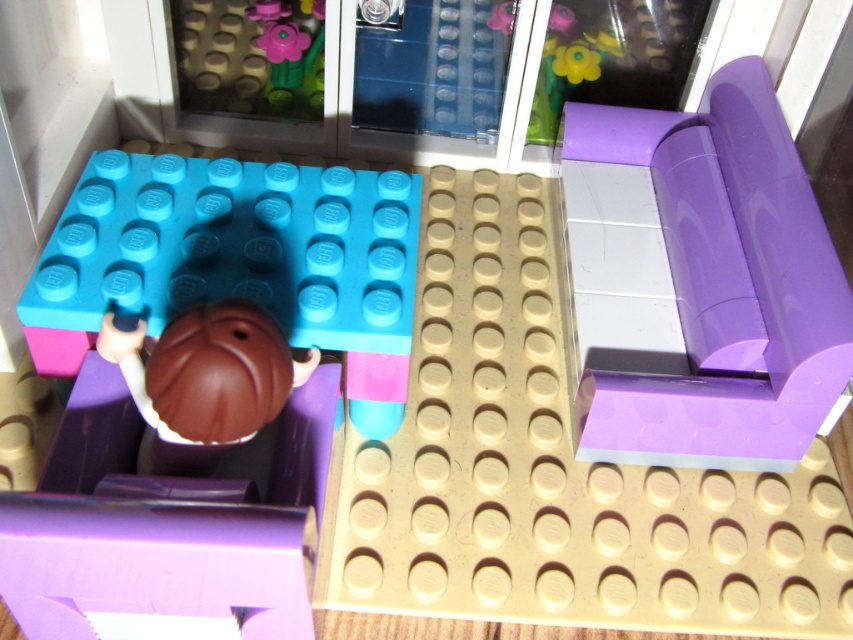
Question: Does purple glossy couch at upper right have a greater width compared to matte blue plate at center?

Choices:
 (A) no
 (B) yes

Answer: (A)

Question: Does purple glossy couch at upper right appear on the left side of matte blue plate at center?

Choices:
 (A) no
 (B) yes

Answer: (A)

Question: Which point is closer to the camera?

Choices:
 (A) (686, 157)
 (B) (62, 225)

Answer: (B)

Question: Which point is farther to the camera?

Choices:
 (A) matte blue plate at center
 (B) purple glossy couch at upper right

Answer: (B)

Question: Does purple glossy couch at upper right have a larger size compared to matte blue plate at center?

Choices:
 (A) no
 (B) yes

Answer: (B)

Question: Among these objects, which one is nearest to the camera?

Choices:
 (A) matte blue plate at center
 (B) purple glossy couch at upper right

Answer: (A)